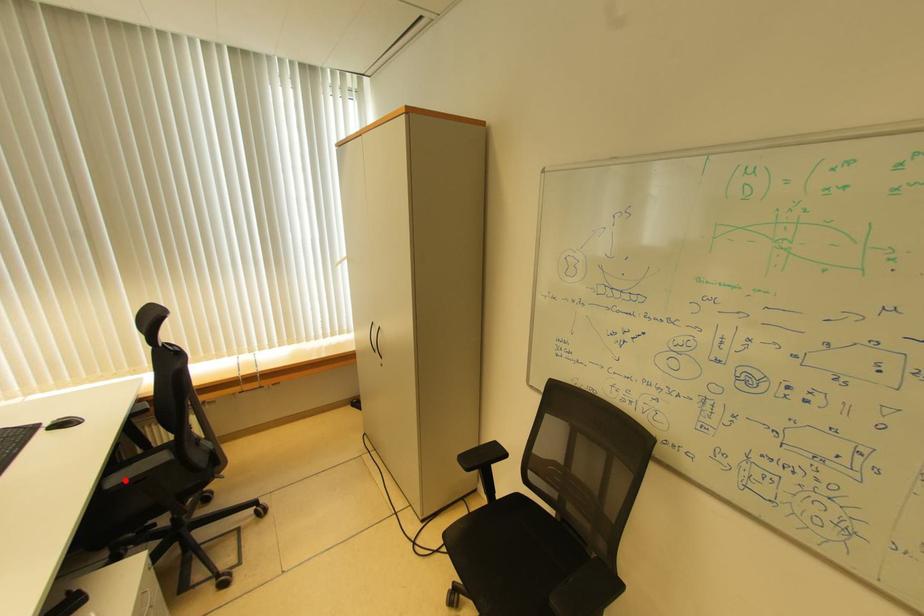
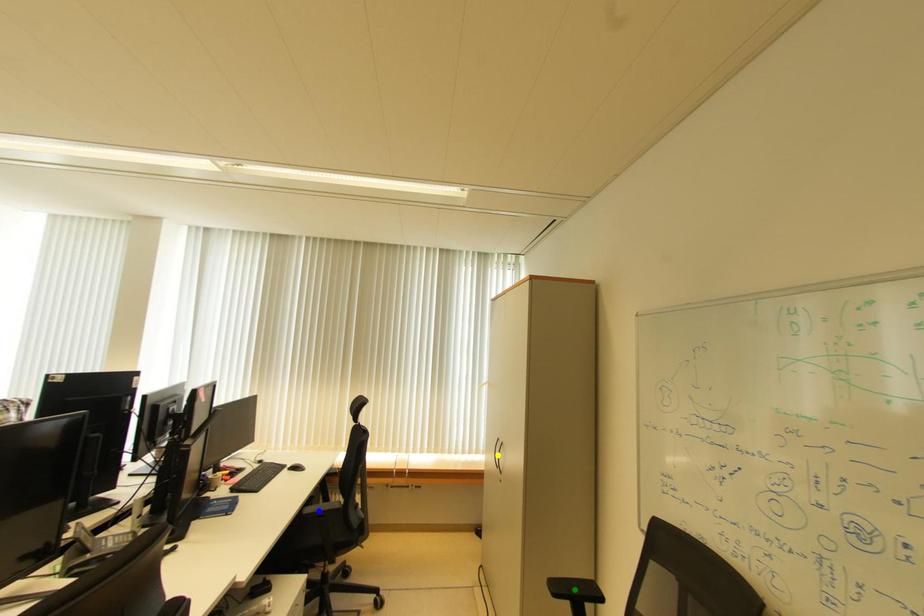
Question: I am providing you with two images of the same scene from different viewpoints. A red point is marked on the first image. You are given multiple points on the second image. Can you choose the point in image 2 that corresponds to the point in image 1?

Choices:
 (A) green point
 (B) yellow point
 (C) blue point

Answer: (C)